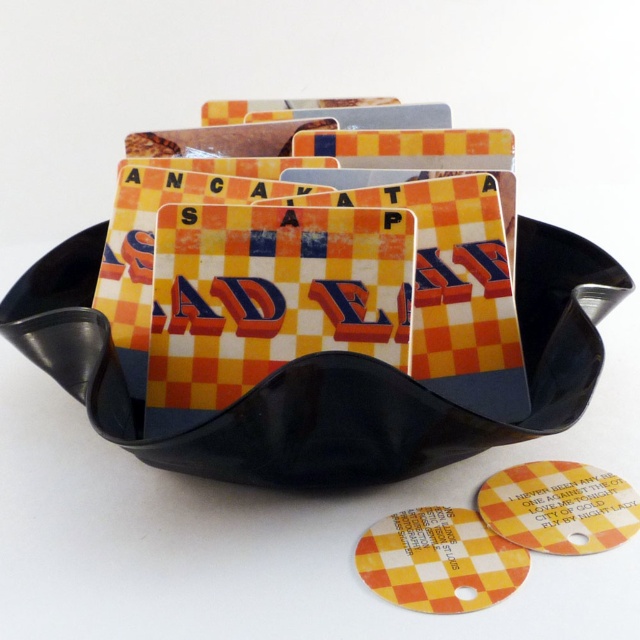
Question: Does yellow checkered card at center have a greater width compared to yellow checkered coaster at center?

Choices:
 (A) yes
 (B) no

Answer: (A)

Question: Which point is farther to the camera?

Choices:
 (A) yellow checkered card at center
 (B) yellow checkered chip at center
 (C) yellow checkered coaster at center

Answer: (C)

Question: Is yellow checkered chip at center to the right of yellow checkered coaster at center from the viewer's perspective?

Choices:
 (A) no
 (B) yes

Answer: (A)

Question: Which point is farther from the camera taking this photo?

Choices:
 (A) (586, 492)
 (B) (104, 419)

Answer: (A)

Question: Which of the following is the closest to the observer?

Choices:
 (A) yellow checkered chip at center
 (B) yellow checkered card at center

Answer: (A)

Question: Can you confirm if yellow checkered card at center is positioned below yellow checkered coaster at center?

Choices:
 (A) yes
 (B) no

Answer: (B)